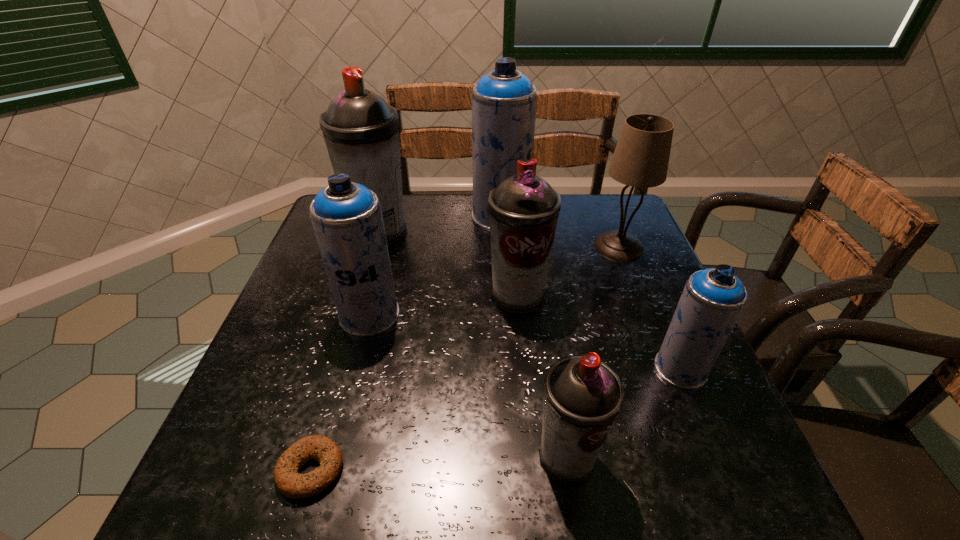
The width and height of the screenshot is (960, 540). In order to click on aerosol can that can be found as the third closest to the leftmost gray aerosol can in this screenshot , I will do [523, 210].

At what (x,y) coordinates should I click in order to perform the action: click on aerosol can that can be found as the fourth closest to the second biggest gray aerosol can. Please return your answer as a coordinate pair (x, y). Looking at the image, I should click on (361, 131).

Locate an element on the screen. This screenshot has width=960, height=540. the second closest gray aerosol can to the second farthest gray aerosol can is located at coordinates (582, 396).

This screenshot has height=540, width=960. Find the location of `gray aerosol can that is the third closest to the lampshade`. gray aerosol can that is the third closest to the lampshade is located at coordinates (361, 131).

Locate an element on the screen. The width and height of the screenshot is (960, 540). blue aerosol can that stands as the closest to the leftmost gray aerosol can is located at coordinates (504, 101).

Identify which blue aerosol can is the nearest to the second biggest gray aerosol can. Please provide its 2D coordinates. Your answer should be formatted as a tuple, i.e. [(x, y)], where the tuple contains the x and y coordinates of a point satisfying the conditions above.

[(504, 101)]

Find the location of `vacant area in the image that satisfies the following two spatial constraints: 1. on the front-facing side of the lampshade; 2. on the right side of the rightmost blue aerosol can`. vacant area in the image that satisfies the following two spatial constraints: 1. on the front-facing side of the lampshade; 2. on the right side of the rightmost blue aerosol can is located at coordinates pos(667,368).